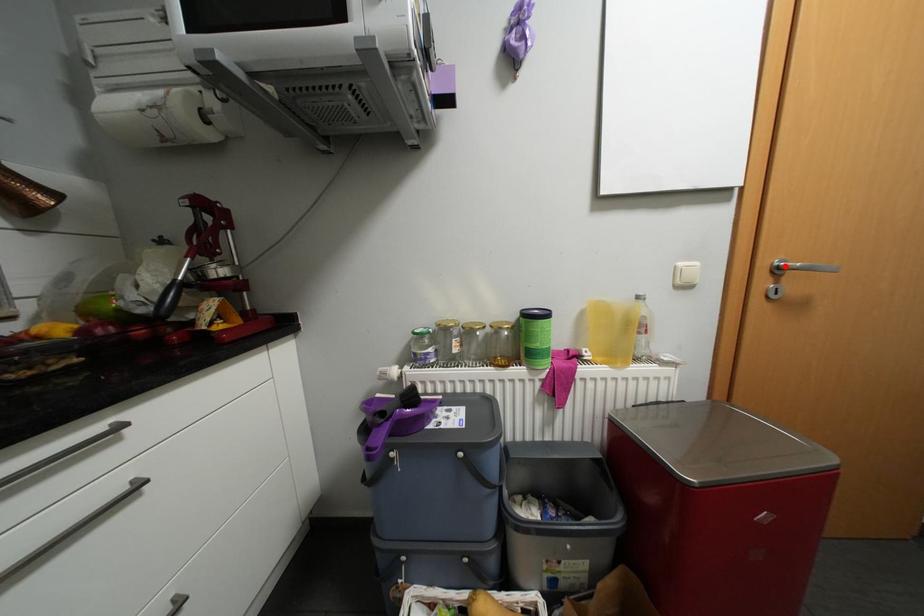
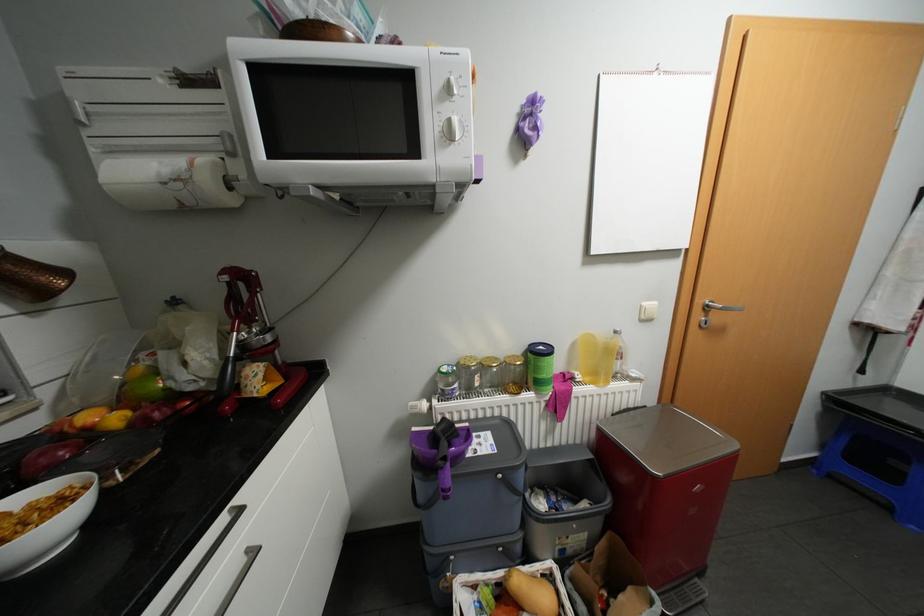
Where in the second image is the point corresponding to the highlighted location from the first image?

(715, 305)